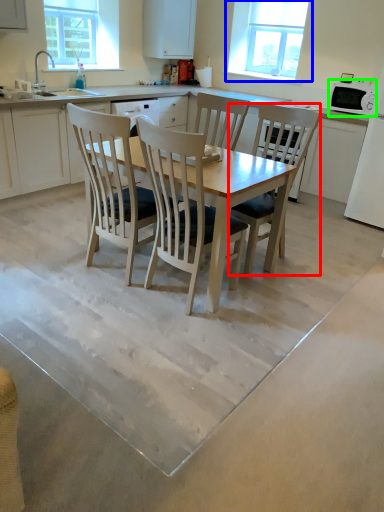
Question: Based on their relative distances, which object is farther from chair (highlighted by a red box)? Choose from window (highlighted by a blue box) and appliance (highlighted by a green box).

Choices:
 (A) window
 (B) appliance

Answer: (A)